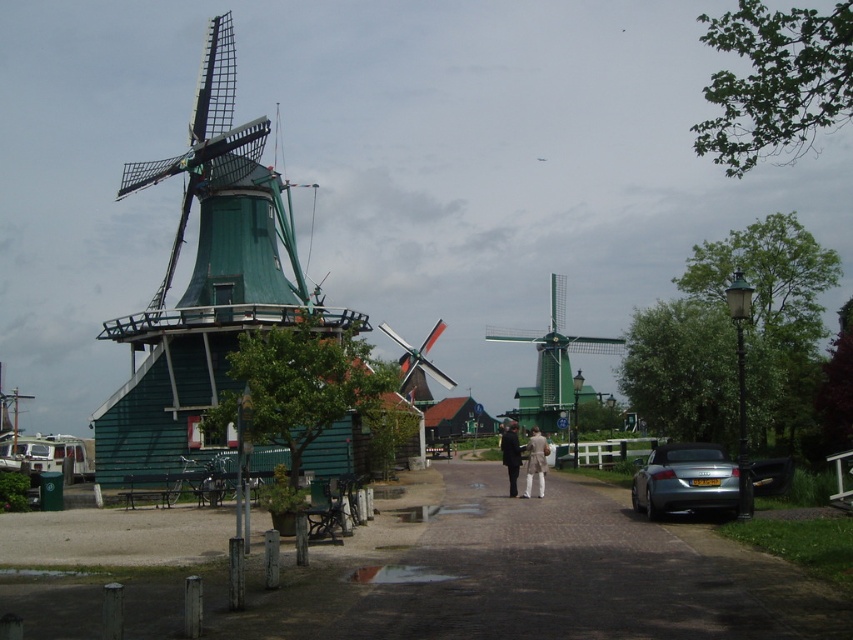
Between green wooden windmill at center and dark brown leather jacket at center, which one is positioned lower?

dark brown leather jacket at center is below.

Which is in front, point (524, 394) or point (515, 449)?

Point (515, 449)

At what (x,y) coordinates should I click in order to perform the action: click on green wooden windmill at center. Please return your answer as a coordinate pair (x, y). This screenshot has height=640, width=853. Looking at the image, I should click on (550, 364).

Between point (570, 541) and point (543, 458), which one is positioned behind?

The point (543, 458) is more distant.

Is point (556, 545) closer to camera compared to point (532, 472)?

Yes, it is in front of point (532, 472).

Who is more distant from viewer, (477, 502) or (543, 488)?

The point (543, 488) is more distant.

At what (x,y) coordinates should I click in order to perform the action: click on dark brown cobblestone at center. Please return your answer as a coordinate pair (x, y). The width and height of the screenshot is (853, 640). Looking at the image, I should click on pyautogui.click(x=579, y=573).

Does green wooden windmill at left have a smaller size compared to dark brown leather jacket at center?

Actually, green wooden windmill at left might be larger than dark brown leather jacket at center.

Which is in front, point (132, 412) or point (515, 464)?

Point (515, 464)

Find the location of `green wooden windmill at left`. green wooden windmill at left is located at coordinates (206, 284).